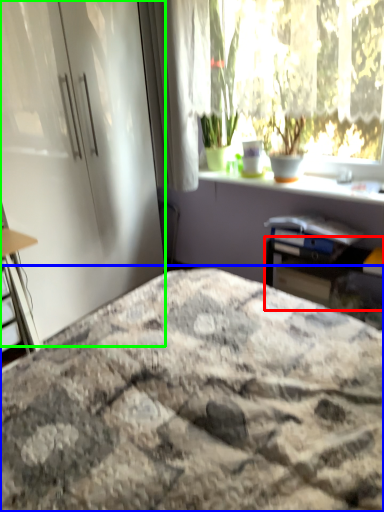
Question: Which object is positioned closest to table (highlighted by a red box)? Select from bed (highlighted by a blue box) and screen door (highlighted by a green box).

Choices:
 (A) bed
 (B) screen door

Answer: (A)